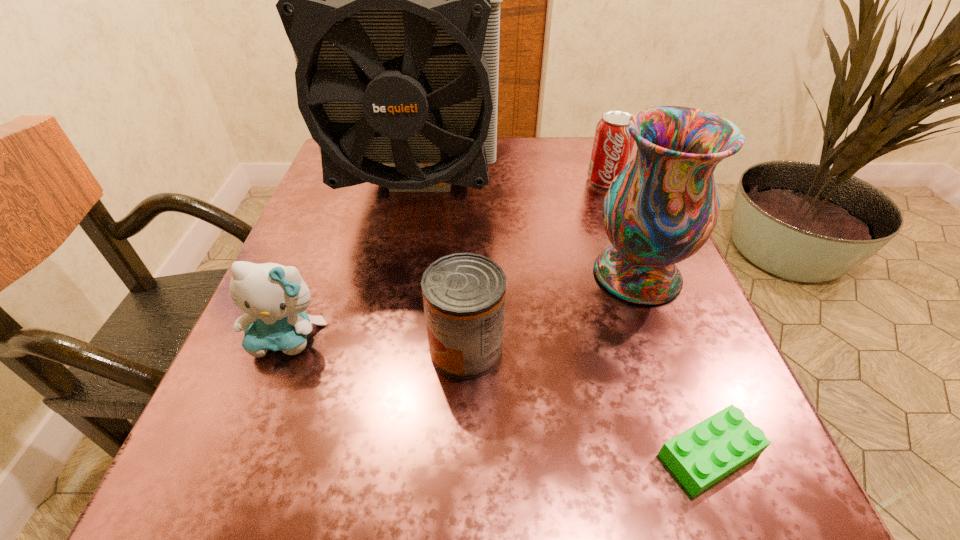
Locate an element on the screen. vacant area located on the face of the kitten is located at coordinates (249, 436).

Find the location of a particular element. Image resolution: width=960 pixels, height=540 pixels. vacant space located 0.350m on the left of the soda can is located at coordinates (429, 180).

Locate an element on the screen. The height and width of the screenshot is (540, 960). vacant position located 0.100m on the front of the can is located at coordinates (464, 451).

You are a GUI agent. You are given a task and a screenshot of the screen. Output one action in this format:
    pyautogui.click(x=<x>, y=<y>)
    Task: Click on the vacant space located on the left of the shortest object
    The height and width of the screenshot is (540, 960).
    Given the screenshot: What is the action you would take?
    pyautogui.click(x=566, y=454)

Find the location of a particular element. fan at the far edge is located at coordinates (391, 0).

Where is `soda can that is positioned at the far edge`? soda can that is positioned at the far edge is located at coordinates (612, 148).

I want to click on object at the near edge, so click(x=701, y=456).

This screenshot has width=960, height=540. I want to click on fan that is at the left edge, so click(x=391, y=0).

Where is `kitten that is at the left edge`? Image resolution: width=960 pixels, height=540 pixels. kitten that is at the left edge is located at coordinates (274, 297).

The height and width of the screenshot is (540, 960). In order to click on vase located in the right edge section of the desktop in this screenshot , I will do `click(662, 207)`.